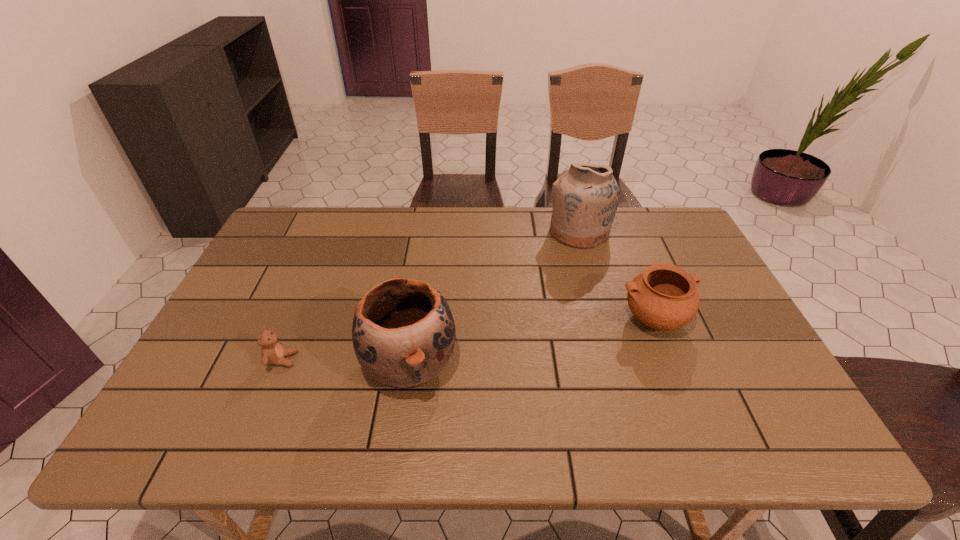
Locate which pottery is the third closest to the leftmost object. Please provide its 2D coordinates. Your answer should be formatted as a tuple, i.e. [(x, y)], where the tuple contains the x and y coordinates of a point satisfying the conditions above.

[(664, 297)]

Where is `the closest pottery relative to the tallest object`? The height and width of the screenshot is (540, 960). the closest pottery relative to the tallest object is located at coordinates (664, 297).

You are a GUI agent. You are given a task and a screenshot of the screen. Output one action in this format:
    pyautogui.click(x=<x>, y=<y>)
    Task: Click on the free point that satisfies the following two spatial constraints: 1. on the back side of the second shortest object; 2. on the right side of the second tallest object
    Image resolution: width=960 pixels, height=540 pixels.
    Given the screenshot: What is the action you would take?
    pyautogui.click(x=417, y=320)

Find the location of `blank area in the image that satisfies the following two spatial constraints: 1. on the back side of the second tallest pottery; 2. on the left side of the farthest object`. blank area in the image that satisfies the following two spatial constraints: 1. on the back side of the second tallest pottery; 2. on the left side of the farthest object is located at coordinates (429, 231).

In order to click on free space in the image that satisfies the following two spatial constraints: 1. on the front side of the shortest pottery; 2. on the right side of the tallest pottery in this screenshot , I will do `click(604, 320)`.

At what (x,y) coordinates should I click in order to perform the action: click on blank space that satisfies the following two spatial constraints: 1. on the back side of the shortest pottery; 2. on the right side of the leftmost pottery. Please return your answer as a coordinate pair (x, y). This screenshot has height=540, width=960. Looking at the image, I should click on (417, 320).